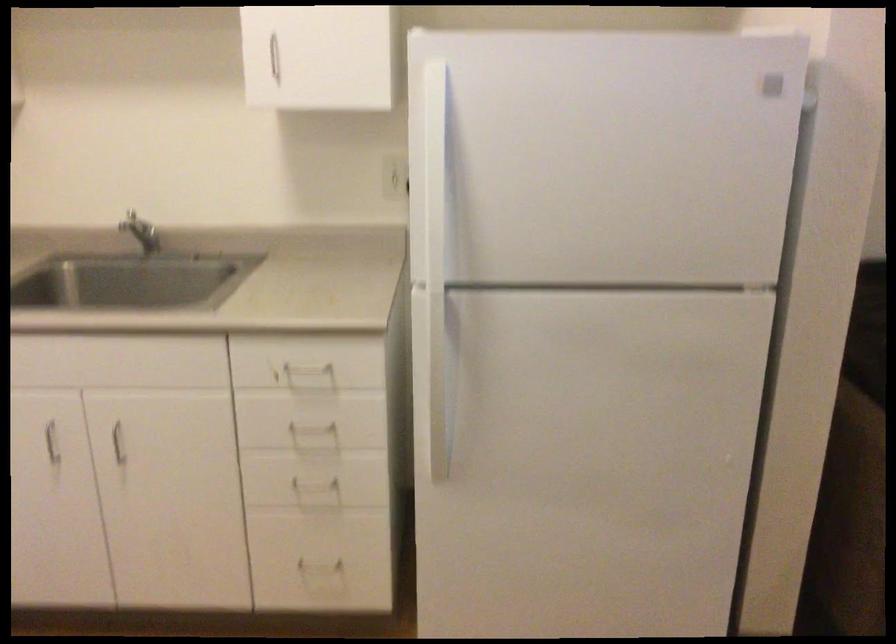
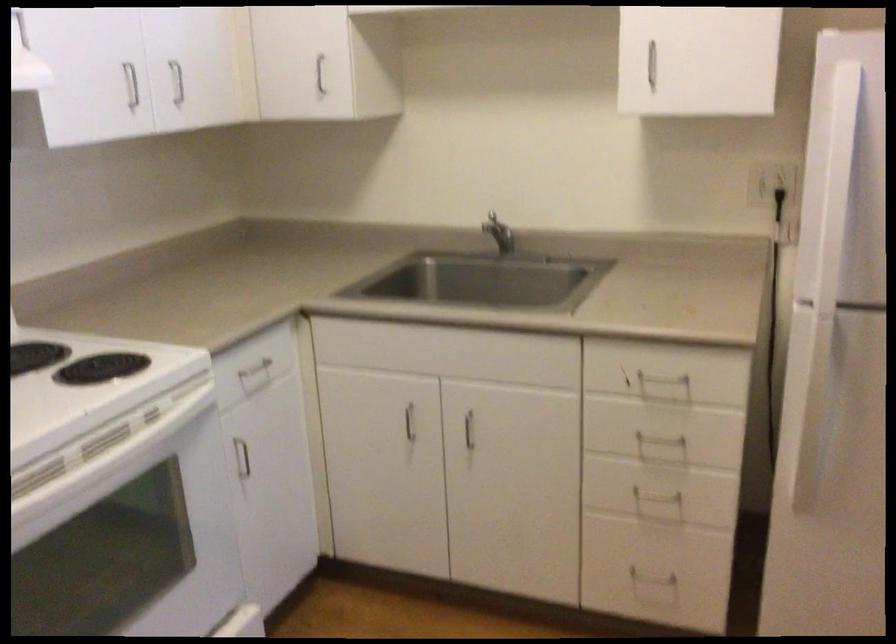
Question: The images are taken continuously from a first-person perspective. In which direction are you moving?

Choices:
 (A) Left
 (B) Right
 (C) Forward
 (D) Backward

Answer: (A)